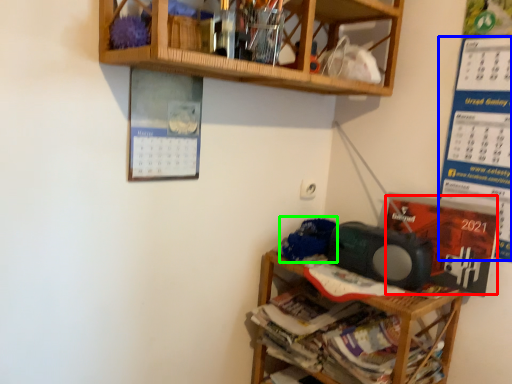
Question: Which is nearer to the writing (highlighted by a red box)? writing (highlighted by a blue box) or waste (highlighted by a green box).

Choices:
 (A) writing
 (B) waste

Answer: (A)